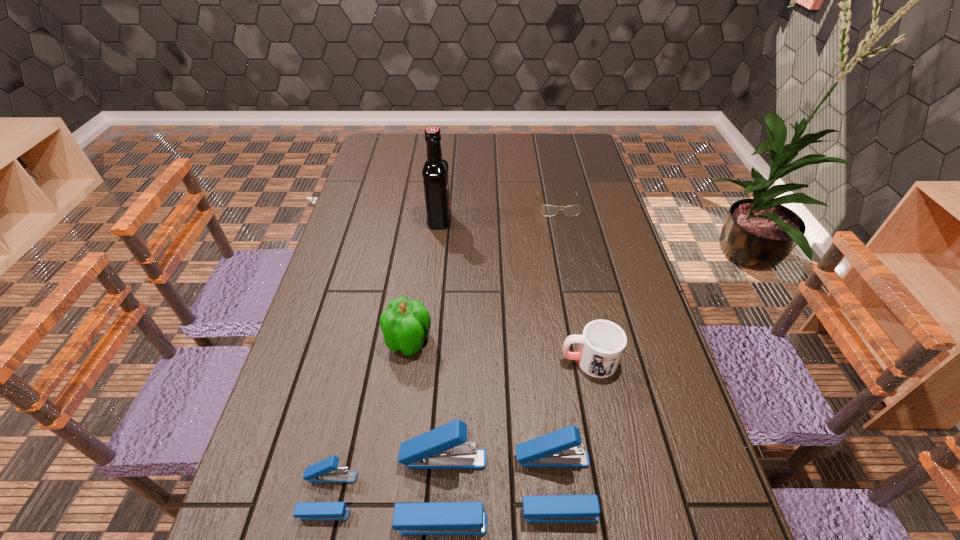
Locate an element on the screen. The height and width of the screenshot is (540, 960). vacant area that lies between the tallest object and the rightmost stapler is located at coordinates (497, 353).

I want to click on free space between the shortest object and the liquor, so click(498, 213).

The height and width of the screenshot is (540, 960). What are the coordinates of `free space that is in between the bell pepper and the tallest object` in the screenshot? It's located at (424, 281).

Find the location of `empty location between the mug and the shortest object`. empty location between the mug and the shortest object is located at coordinates (573, 283).

At what (x,y) coordinates should I click in order to perform the action: click on free point between the second stapler from left to right and the bell pepper. Please return your answer as a coordinate pair (x, y). Looking at the image, I should click on (425, 416).

Where is `vacant space that's between the rightmost stapler and the tallest object`? This screenshot has width=960, height=540. vacant space that's between the rightmost stapler and the tallest object is located at coordinates (497, 353).

The image size is (960, 540). What are the coordinates of `free space between the rightmost stapler and the bell pepper` in the screenshot? It's located at (482, 414).

Select which object is the third closest to the tallest object. Please provide its 2D coordinates. Your answer should be formatted as a tuple, i.e. [(x, y)], where the tuple contains the x and y coordinates of a point satisfying the conditions above.

[(602, 343)]

I want to click on object that stands as the third closest to the second stapler from left to right, so click(x=405, y=324).

Find the location of `stapler object that ranks as the third closest to the bell pepper`. stapler object that ranks as the third closest to the bell pepper is located at coordinates (562, 448).